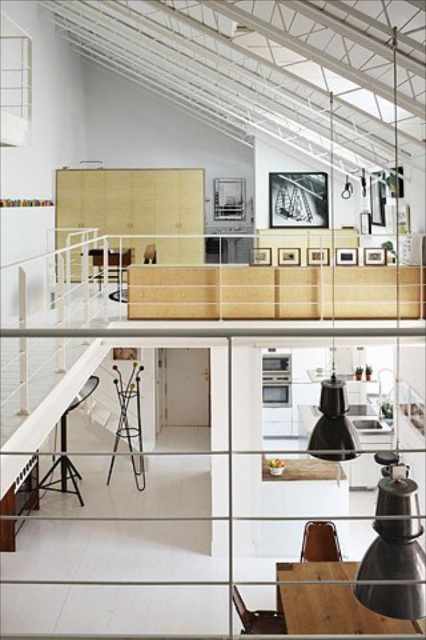
Can you confirm if brown wooden chair at lower right is positioned to the left of wooden chair at center?

Incorrect, brown wooden chair at lower right is not on the left side of wooden chair at center.

Can you confirm if brown wooden chair at lower right is thinner than wooden chair at center?

No, brown wooden chair at lower right is not thinner than wooden chair at center.

Is point (242, 602) positioned after point (147, 259)?

No, it is in front of (147, 259).

The image size is (426, 640). What are the coordinates of `brown wooden chair at lower right` in the screenshot? It's located at (258, 618).

Does matte black lampshade at right appear under brown leather chair at lower center?

Incorrect, matte black lampshade at right is not positioned below brown leather chair at lower center.

Who is more distant from viewer, (394, 467) or (336, 541)?

Positioned behind is point (336, 541).

Find the location of `matte black lampshade at right`. matte black lampshade at right is located at coordinates (394, 547).

Is metallic wire chair at center to the left of brown leather chair at lower center from the viewer's perspective?

Indeed, metallic wire chair at center is positioned on the left side of brown leather chair at lower center.

Does metallic wire chair at center lie in front of brown leather chair at lower center?

No, it is not.

What do you see at coordinates (129, 422) in the screenshot?
I see `metallic wire chair at center` at bounding box center [129, 422].

Find the location of `metallic wire chair at center`. metallic wire chair at center is located at coordinates (129, 422).